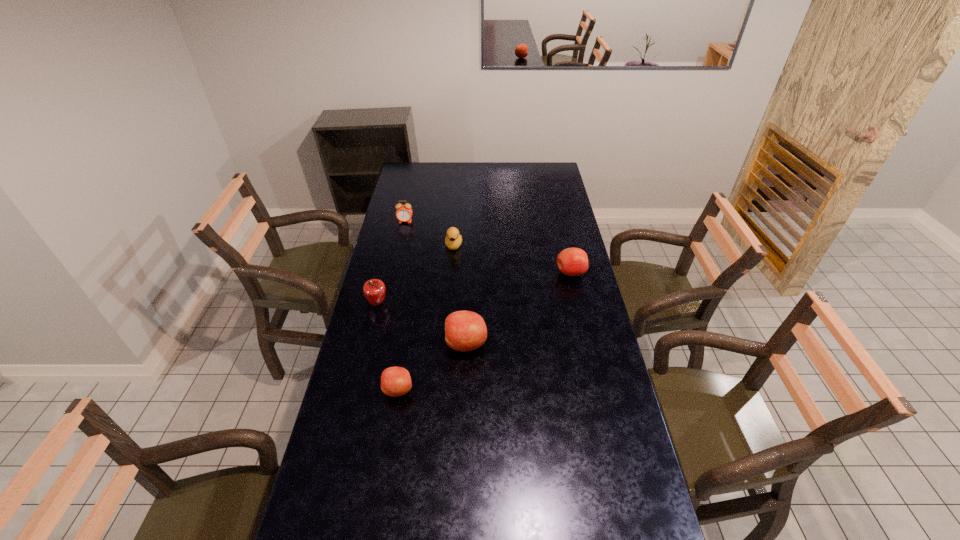
In order to click on blank space at the left edge of the desktop in this screenshot , I will do `click(396, 241)`.

Locate an element on the screen. This screenshot has height=540, width=960. free space at the right edge of the desktop is located at coordinates (564, 200).

Find the location of a particular element. The width and height of the screenshot is (960, 540). vacant area at the far left corner of the desktop is located at coordinates (414, 176).

The width and height of the screenshot is (960, 540). What are the coordinates of `unoccupied area between the fourth nearest object and the fifth nearest object` in the screenshot? It's located at (513, 259).

I want to click on vacant space that's between the second farthest apple and the fourth object from right to left, so pos(388,347).

I want to click on unoccupied area between the nearest apple and the alarm clock, so click(x=402, y=306).

Find the location of a particular element. blank region between the farthest object and the tallest apple is located at coordinates [436, 282].

The image size is (960, 540). I want to click on vacant space in between the tallest apple and the fifth nearest object, so click(x=460, y=294).

The width and height of the screenshot is (960, 540). Find the location of `vacant space in between the farthest object and the third object from left to right`. vacant space in between the farthest object and the third object from left to right is located at coordinates (402, 306).

Locate an element on the screen. The image size is (960, 540). free space between the farthest object and the nearest object is located at coordinates (402, 306).